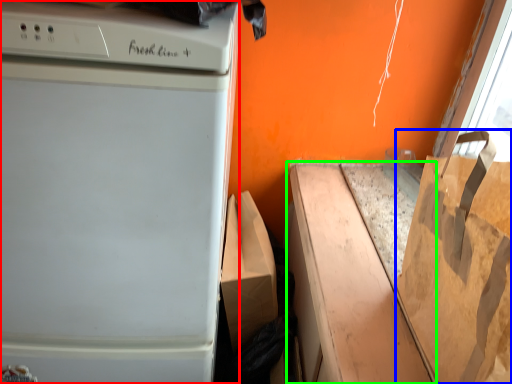
Question: Which object is the closest to the home appliance (highlighted by a red box)? Choose among these: grocery bag (highlighted by a blue box) or cardboard box (highlighted by a green box).

Choices:
 (A) grocery bag
 (B) cardboard box

Answer: (B)